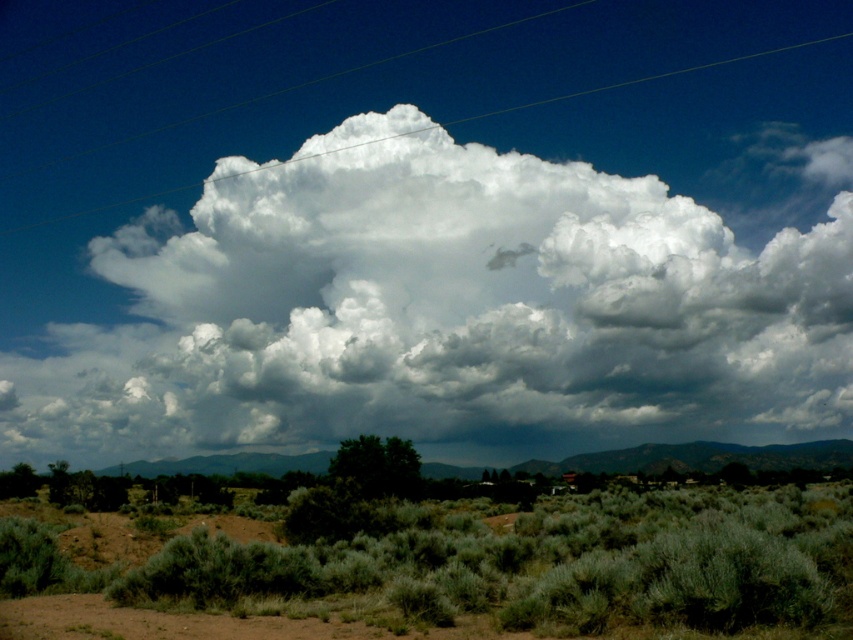
Question: Can you confirm if green shrubbery at lower center is smaller than clear plastic power lines at upper center?

Choices:
 (A) no
 (B) yes

Answer: (B)

Question: Considering the real-world distances, which object is closest to the green shrubbery at lower center?

Choices:
 (A) white fluffy cloud at upper center
 (B) clear plastic power lines at upper center

Answer: (A)

Question: Which of these objects is positioned closest to the white fluffy cloud at upper center?

Choices:
 (A) clear plastic power lines at upper center
 (B) green shrubbery at lower center

Answer: (A)

Question: Does white fluffy cloud at upper center have a greater width compared to green shrubbery at lower center?

Choices:
 (A) no
 (B) yes

Answer: (B)

Question: Which of the following is the closest to the observer?

Choices:
 (A) (152, 337)
 (B) (512, 24)
 (C) (685, 592)

Answer: (C)

Question: Is green shrubbery at lower center below clear plastic power lines at upper center?

Choices:
 (A) no
 (B) yes

Answer: (B)